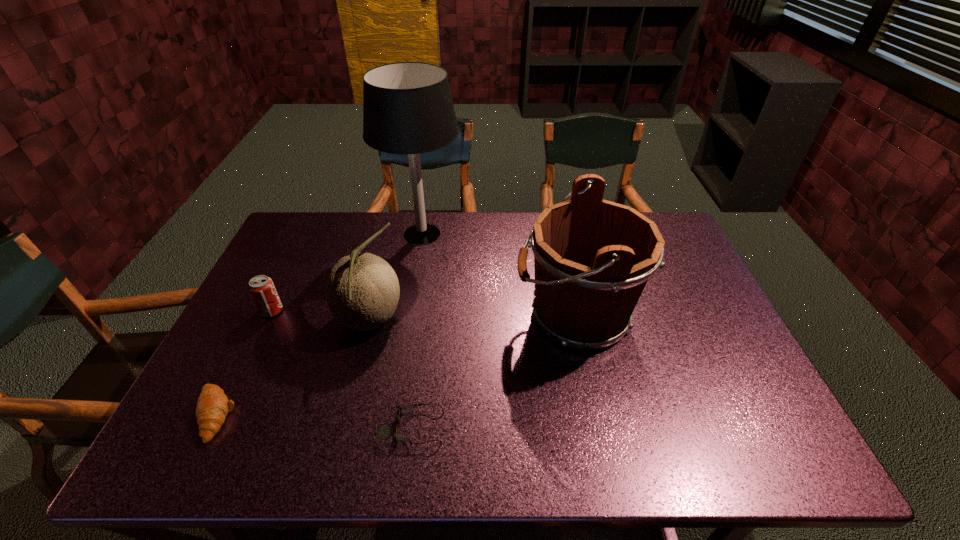
Image resolution: width=960 pixels, height=540 pixels. Find the location of `crescent roll that is at the left edge`. crescent roll that is at the left edge is located at coordinates (213, 405).

You are a GUI agent. You are given a task and a screenshot of the screen. Output one action in this format:
    pyautogui.click(x=<x>, y=<y>)
    Task: Click on the object situated at the near left corner
    This screenshot has height=540, width=960.
    Given the screenshot: What is the action you would take?
    pyautogui.click(x=213, y=405)

Find the location of a particular element. free space at the far edge is located at coordinates (335, 251).

The height and width of the screenshot is (540, 960). Find the location of `vacant region at the near edge of the desktop`. vacant region at the near edge of the desktop is located at coordinates (636, 463).

Locate an element on the screen. The height and width of the screenshot is (540, 960). blank space at the left edge of the desktop is located at coordinates (279, 349).

Locate an element on the screen. The height and width of the screenshot is (540, 960). vacant region at the right edge of the desktop is located at coordinates [x=712, y=409].

You are a GUI agent. You are given a task and a screenshot of the screen. Output one action in this format:
    pyautogui.click(x=<x>, y=<y>)
    Task: Click on the free space at the near right corner
    
    Given the screenshot: What is the action you would take?
    pyautogui.click(x=717, y=441)

Where is `free space between the cantaloup and the fourth tallest object`? free space between the cantaloup and the fourth tallest object is located at coordinates click(x=321, y=316).

This screenshot has height=540, width=960. Find the location of `empty space between the farthest object and the shortest object`. empty space between the farthest object and the shortest object is located at coordinates (418, 330).

At what (x,y) coordinates should I click in order to perform the action: click on vacant area between the shortest object and the crescent roll. Please return your answer as a coordinate pair (x, y). The height and width of the screenshot is (540, 960). Looking at the image, I should click on (313, 421).